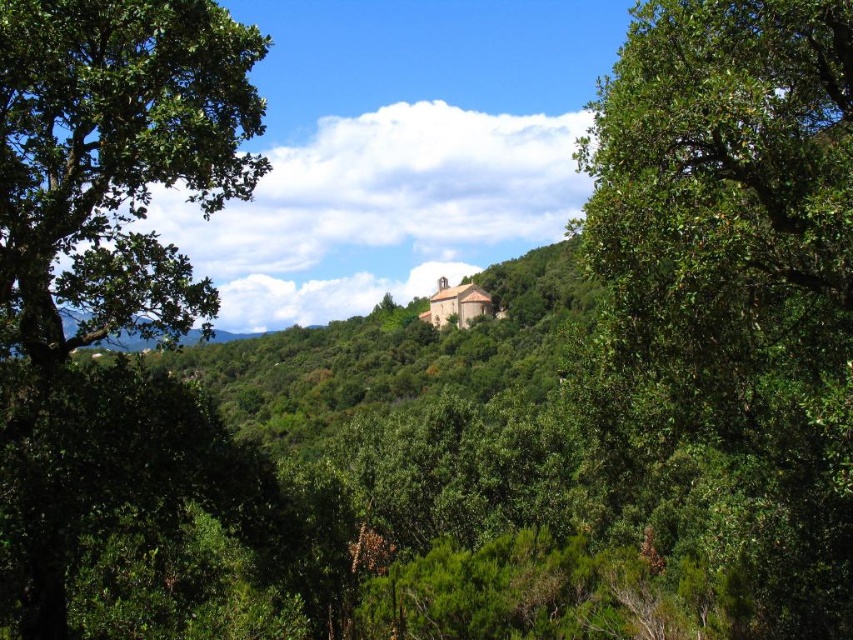
Is the position of green leafy tree at center more distant than that of green leafy tree at left?

That is False.

Between green leafy tree at center and green leafy tree at left, which one appears on the left side from the viewer's perspective?

green leafy tree at left is more to the left.

Which is behind, point (845, 547) or point (187, 86)?

The point (845, 547) is behind.

You are a GUI agent. You are given a task and a screenshot of the screen. Output one action in this format:
    pyautogui.click(x=<x>, y=<y>)
    Task: Click on the green leafy tree at center
    Image resolution: width=853 pixels, height=640 pixels.
    Given the screenshot: What is the action you would take?
    pyautogui.click(x=740, y=264)